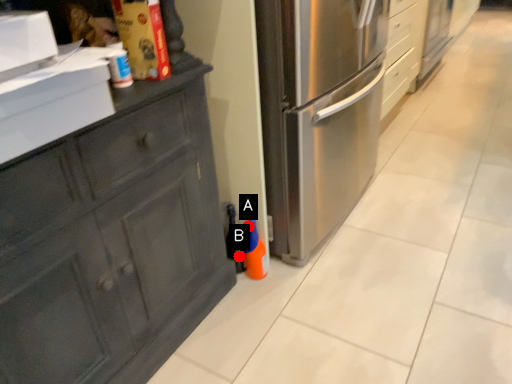
Question: Two points are circled on the image, labeled by A and B beside each circle. Which of the following is the farthest from the observer?

Choices:
 (A) A is further
 (B) B is further

Answer: (B)